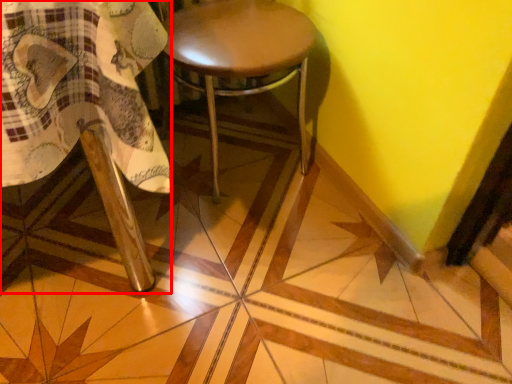
Question: From the image's perspective, what is the correct spatial relationship of chair (annotated by the red box) in relation to stool?

Choices:
 (A) below
 (B) above

Answer: (A)